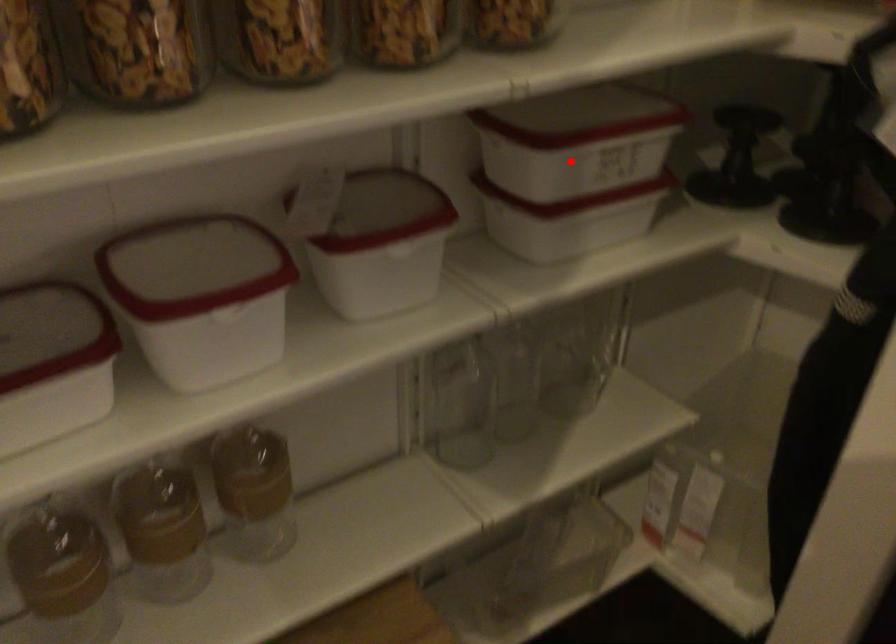
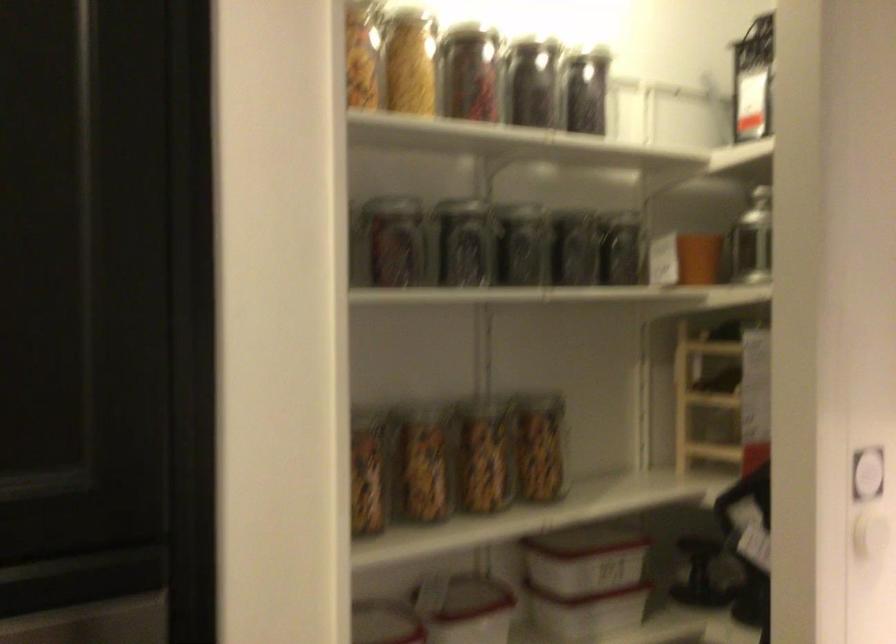
Locate, in the second image, the point that corresponds to the highlighted location in the first image.

(582, 572)